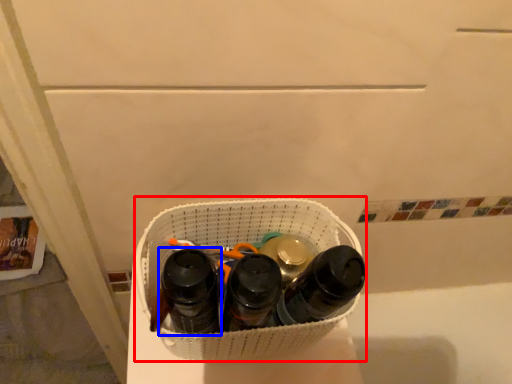
Question: Among these objects, which one is nearest to the camera, laundry basket (highlighted by a red box) or footwear (highlighted by a blue box)?

Choices:
 (A) laundry basket
 (B) footwear

Answer: (B)